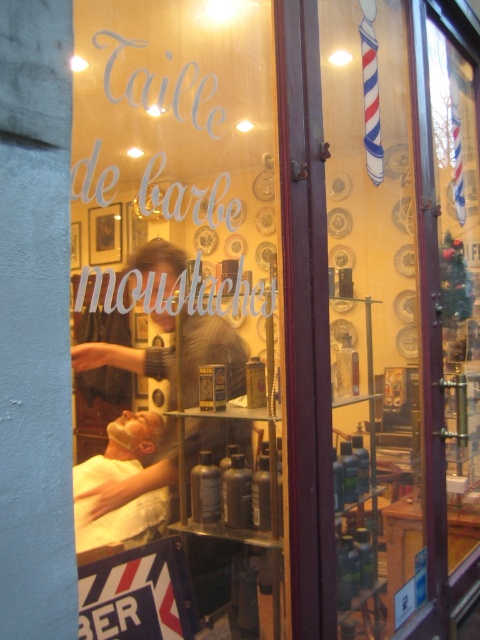
Can you confirm if matte glass sign at center is bigger than white cloth at lower left?

Yes.

Does point (184, 349) come farther from viewer compared to point (109, 470)?

No.

At what (x,y) coordinates should I click in order to perform the action: click on matte glass sign at center. Please return your answer as a coordinate pair (x, y). The height and width of the screenshot is (640, 480). Looking at the image, I should click on (180, 291).

Does clear glass door at center have a lesser height compared to white cloth at lower left?

No, clear glass door at center is not shorter than white cloth at lower left.

Does point (326, 32) lie in front of point (84, 468)?

That is True.

Where is `clear glass door at center`? Image resolution: width=480 pixels, height=640 pixels. clear glass door at center is located at coordinates (399, 308).

Who is positioned more to the right, matte glass sign at center or clear glass door at center?

Positioned to the right is clear glass door at center.

This screenshot has width=480, height=640. Describe the element at coordinates (180, 291) in the screenshot. I see `matte glass sign at center` at that location.

Image resolution: width=480 pixels, height=640 pixels. I want to click on matte glass sign at center, so click(x=180, y=291).